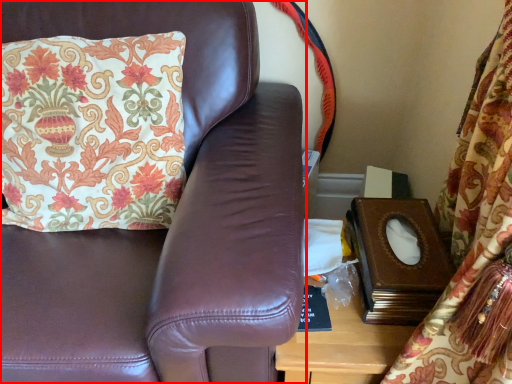
Question: From the image, what is the correct spatial relationship of furniture (annotated by the red box) in relation to pillow?

Choices:
 (A) right
 (B) left

Answer: (B)